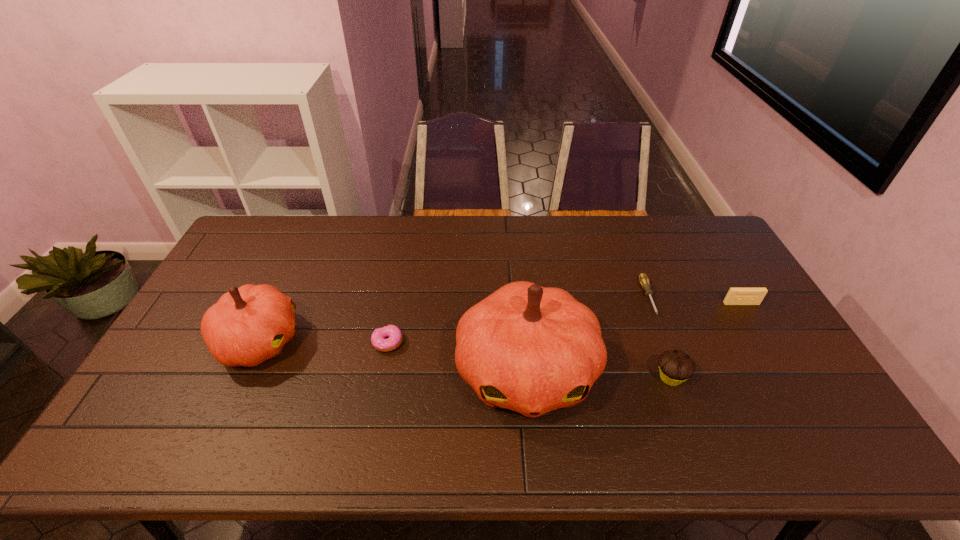
This screenshot has height=540, width=960. What are the coordinates of `blank area in the image that satisfies the following two spatial constraints: 1. on the front-facing side of the muffin; 2. on the right side of the shorter pumpkin` in the screenshot? It's located at (243, 378).

I want to click on free point that satisfies the following two spatial constraints: 1. on the front-facing side of the doughnut; 2. on the right side of the leftmost object, so (x=259, y=342).

This screenshot has width=960, height=540. Identify the location of vacant space that satisfies the following two spatial constraints: 1. on the front-facing side of the fourth shortest object; 2. on the left side of the leftmost object. (243, 378).